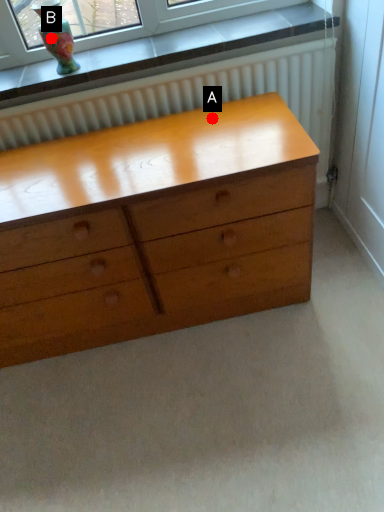
Question: Two points are circled on the image, labeled by A and B beside each circle. Among these points, which one is nearest to the camera?

Choices:
 (A) A is closer
 (B) B is closer

Answer: (B)